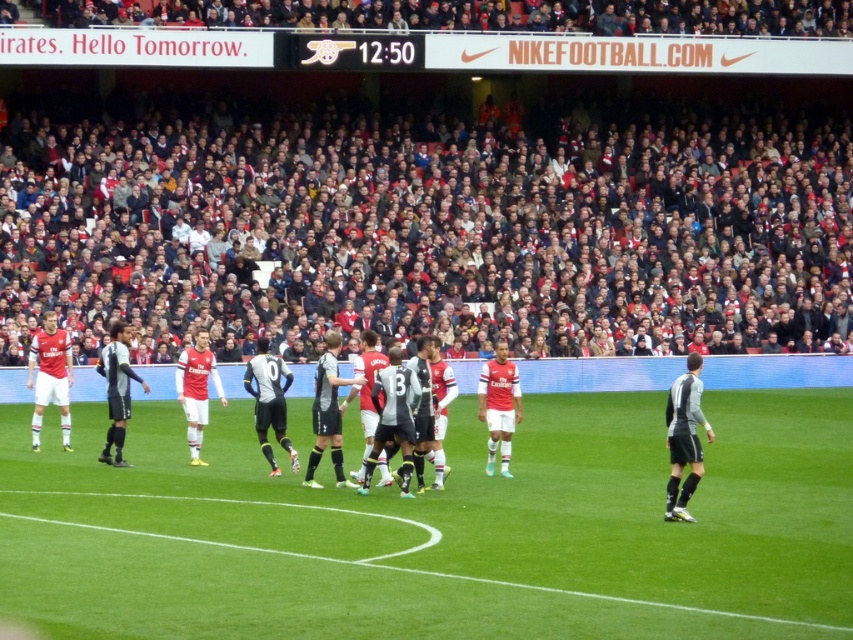
Question: Where is green grass football field at center located in relation to white jersey players at center in the image?

Choices:
 (A) right
 (B) left

Answer: (A)

Question: Which object is the closest to the dark gray fabric crowd at upper center?

Choices:
 (A) green grass football field at center
 (B) black jersey at right

Answer: (A)

Question: Is white jersey players at center bigger than black jersey at right?

Choices:
 (A) no
 (B) yes

Answer: (B)

Question: Which of the following is the farthest from the observer?

Choices:
 (A) dark gray fabric crowd at upper center
 (B) white jersey players at center
 (C) green grass football field at center
 (D) black jersey at right

Answer: (A)

Question: From the image, what is the correct spatial relationship of dark gray fabric crowd at upper center in relation to black jersey at right?

Choices:
 (A) above
 (B) below

Answer: (A)

Question: Which point is farther to the camera?

Choices:
 (A) green grass football field at center
 (B) black jersey at right
 (C) white jersey players at center
 (D) dark gray fabric crowd at upper center

Answer: (D)